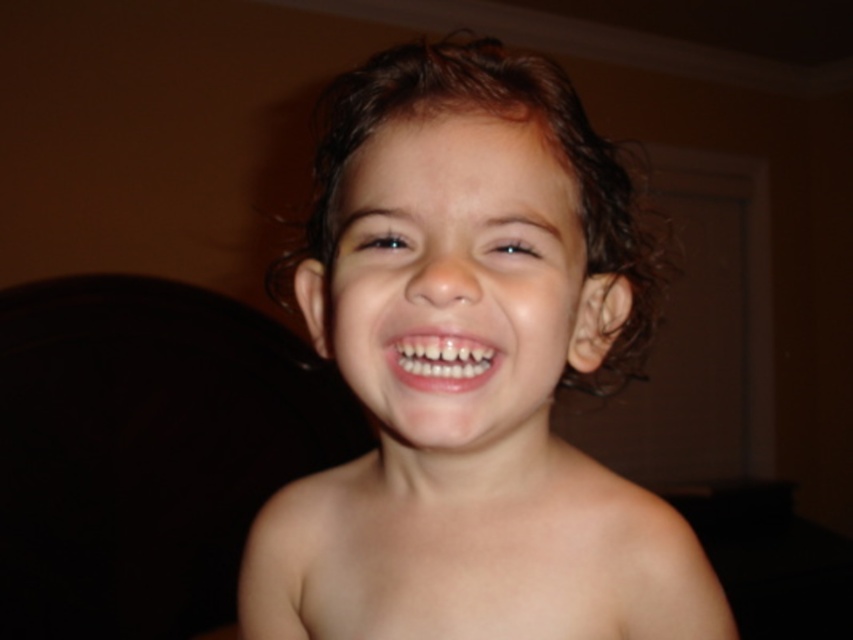
You are taking a photo of a child and want to focus on two points on their face. The first point is at coordinate point (531,376) and the second point is at coordinate point (523,500). Which point should you focus on to ensure it appears clearer in the photo?

Point (531,376) is closer to the camera than point (523,500), so focusing on point (531,376) will make it appear clearer in the photo.